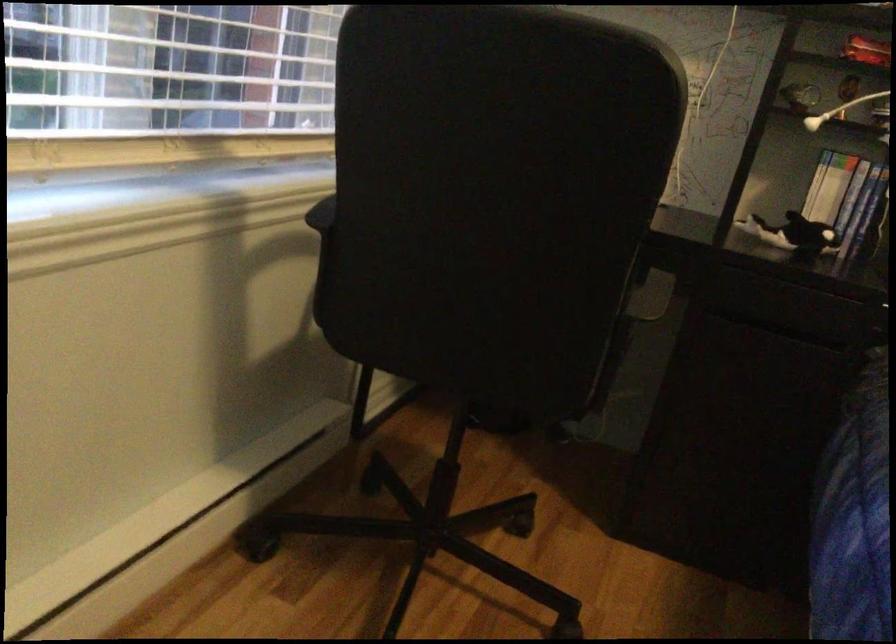
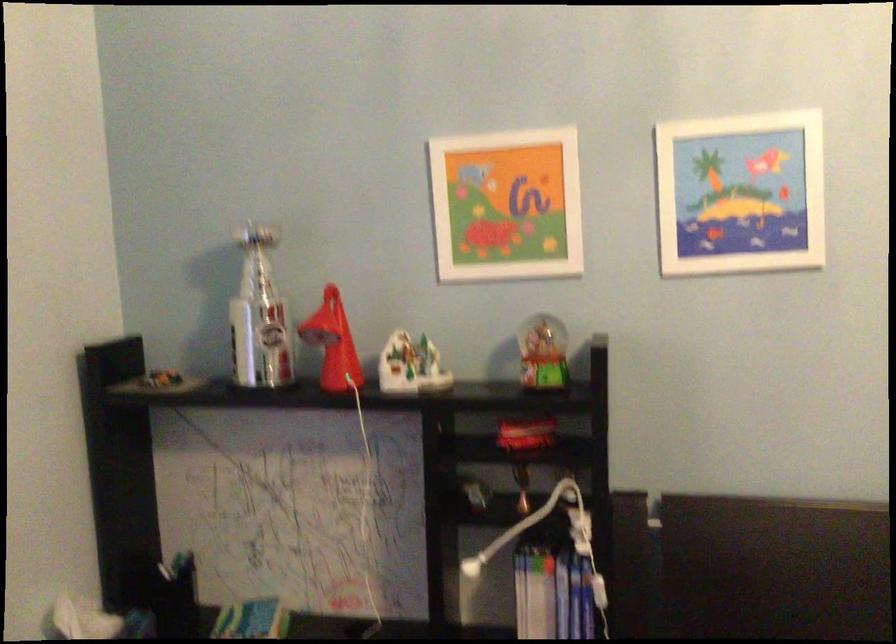
Question: Based on the continuous images, in which direction is the camera rotating? Reply with the corresponding letter.

Choices:
 (A) Left
 (B) Right
 (C) Up
 (D) Down

Answer: (C)